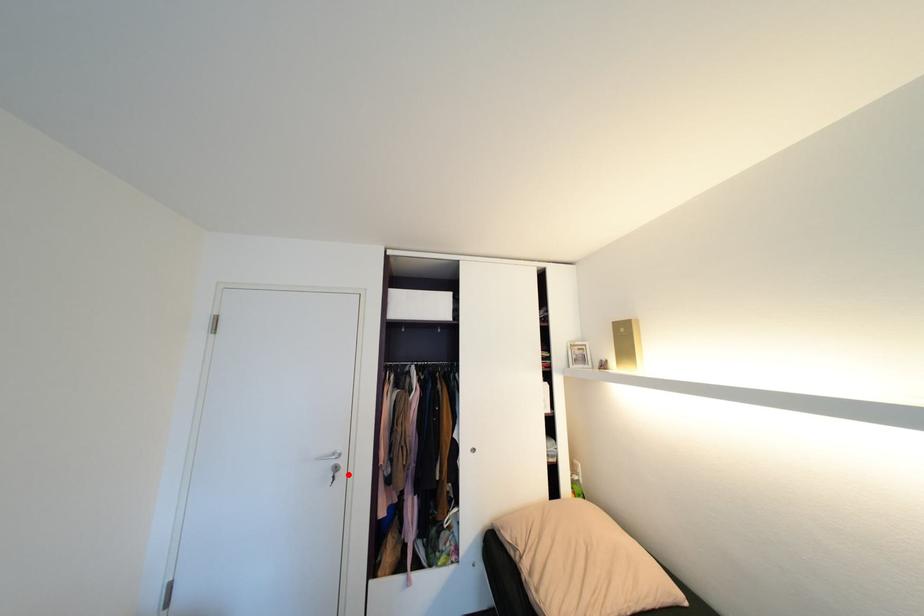
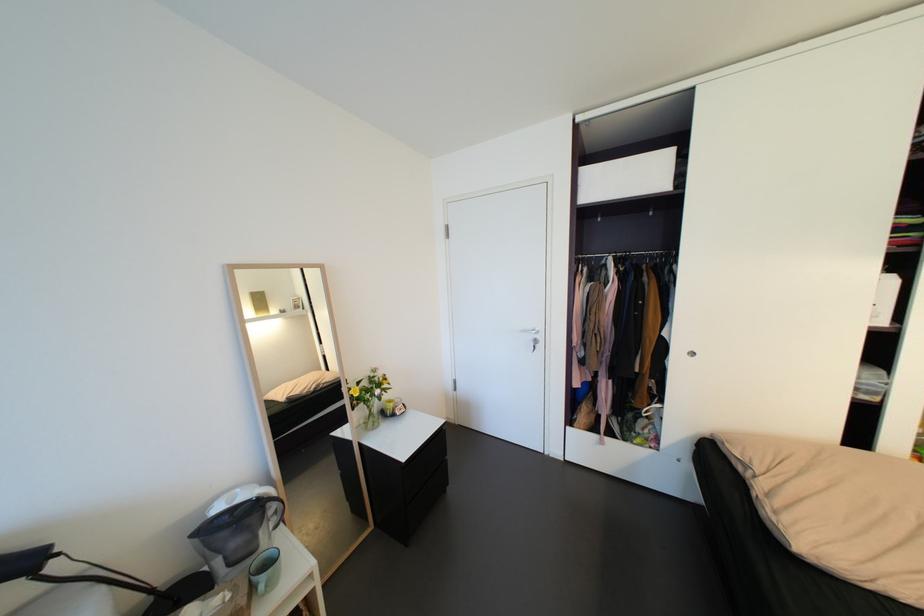
Where in the second image is the point corresponding to the highlighted location from the first image?

(548, 346)